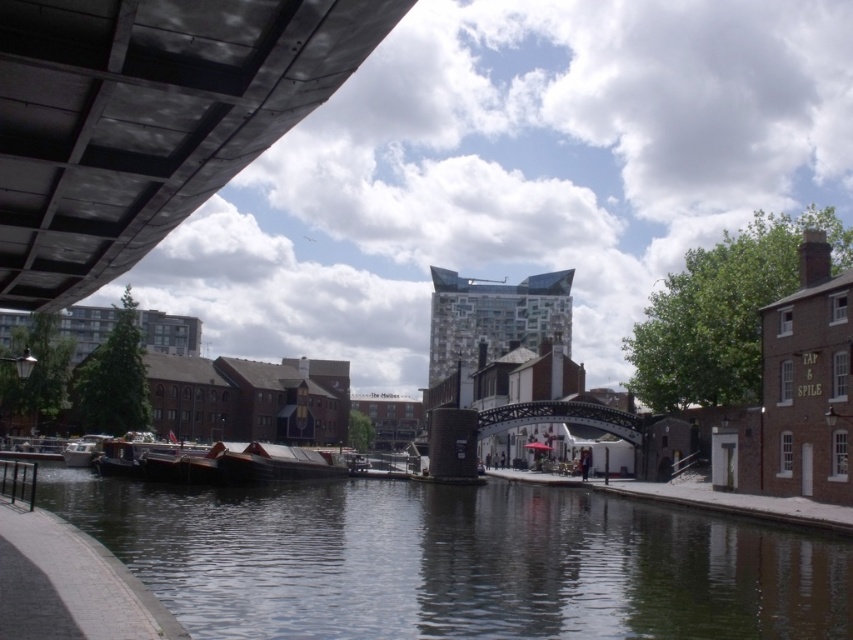
You are standing on the bridge on the left side of the canal. You want to take a photo of the wooden boat at center without including the dark water at center in the frame. Is this possible based on their positions?

The dark water at center is closer to the viewer than the wooden boat at center, so it would block the view of the wooden boat at center. Therefore, it is not possible to take a photo of the wooden boat at center without including the dark water at center in the frame.

You are standing on the bridge on the left side of the canal. You see the dark water at center and the wooden boat at center. Which object is closer to your current position?

The wooden boat at center is closer to your current position because the dark water at center is to the right of the wooden boat at center, meaning the boat is between you and the water.